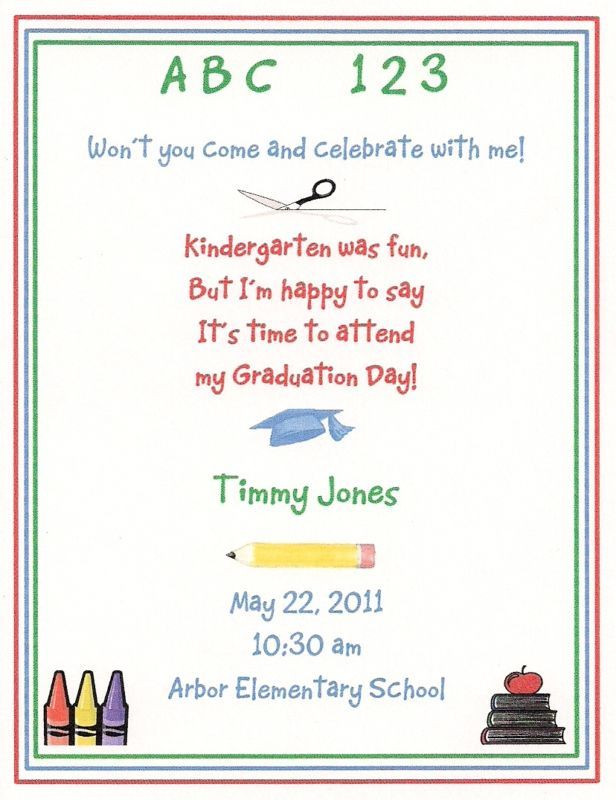
This screenshot has width=616, height=800. In order to click on books in this screenshot , I will do `click(533, 710)`, `click(533, 716)`, `click(528, 737)`.